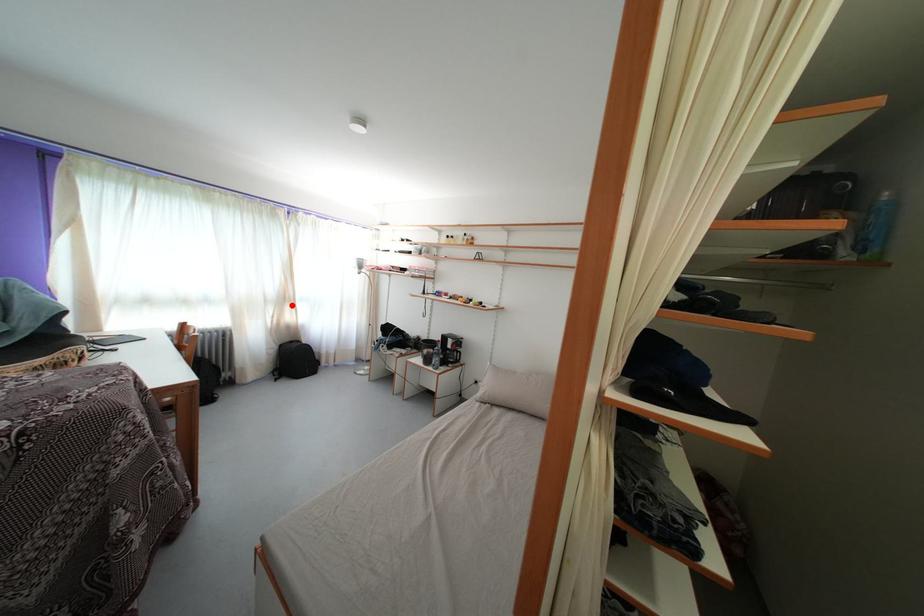
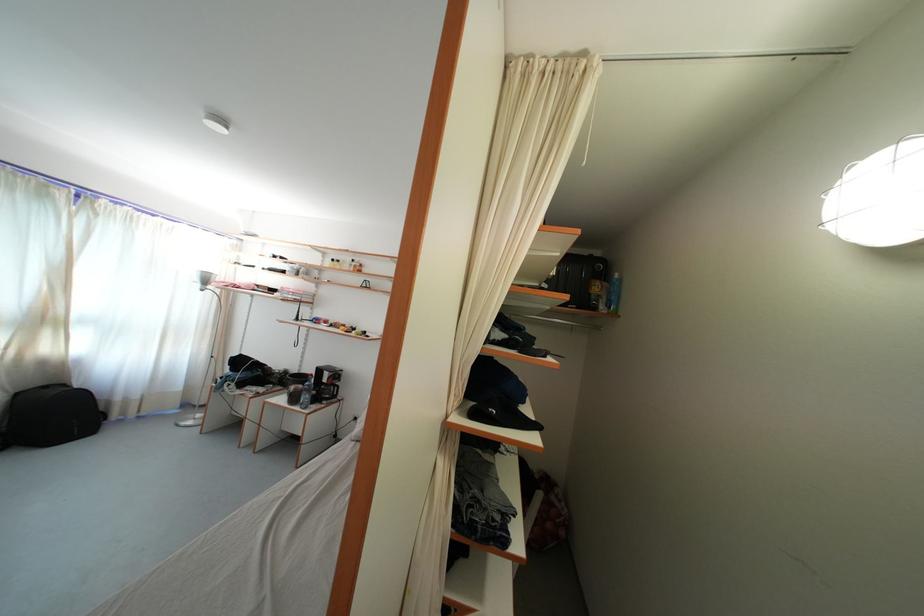
Question: I am providing you with two images of the same scene from different viewpoints. A red point is shown in image1. For the corresponding object point in image2, is it positioned nearer or farther from the camera?

Choices:
 (A) Nearer
 (B) Farther

Answer: (A)